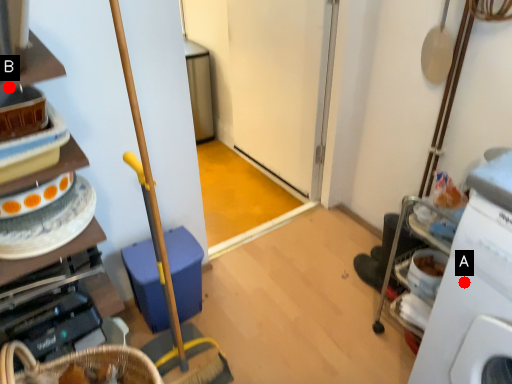
Question: Two points are circled on the image, labeled by A and B beside each circle. Which point is farther to the camera?

Choices:
 (A) A is further
 (B) B is further

Answer: (A)